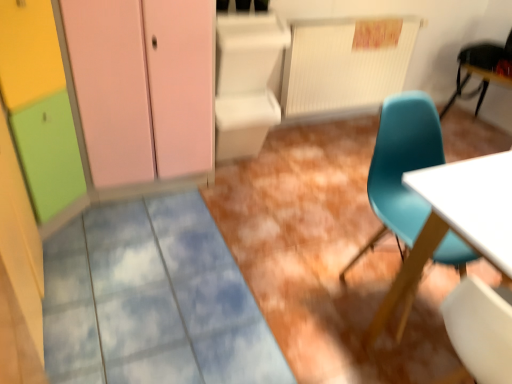
Question: From the image's perspective, is matte plastic chair at right, the first chair viewed from the left, located above or below teal plastic chair at upper right, which ranks as the first chair in back-to-front order?

Choices:
 (A) above
 (B) below

Answer: (B)

Question: Is matte plastic chair at right, arranged as the 1th chair when ordered from the bottom, inside or outside of teal plastic chair at upper right, which is the first chair from right to left?

Choices:
 (A) outside
 (B) inside

Answer: (A)

Question: Which is nearer to the matte pink cabinet at upper left?

Choices:
 (A) matte plastic chair at right, the first chair from the front
 (B) teal plastic chair at upper right, which appears as the 2th chair when viewed from the left

Answer: (A)

Question: Based on their relative distances, which object is nearer to the matte plastic chair at right, the first chair from the front?

Choices:
 (A) matte pink cabinet at upper left
 (B) teal plastic chair at upper right, which ranks as the first chair in back-to-front order

Answer: (A)